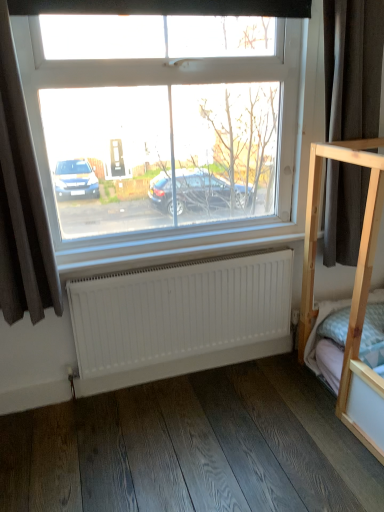
Measure the distance between white matte radiator at lower center and camera.

They are 1.84 meters apart.

The image size is (384, 512). What do you see at coordinates (352, 67) in the screenshot? I see `dark gray fabric at right, placed as the 1th curtain when sorted from right to left` at bounding box center [352, 67].

Where is `white matte radiator at lower center`? white matte radiator at lower center is located at coordinates (179, 311).

From a real-world perspective, is dark gray fabric at right, which is the 2th curtain in left-to-right order, on dark wood flooring at lower center?

Correct, in the physical world, dark gray fabric at right, which is the 2th curtain in left-to-right order, is higher than dark wood flooring at lower center.

Looking at this image, how different are the orientations of dark gray fabric at right, placed as the 1th curtain when sorted from right to left, and dark wood flooring at lower center in degrees?

There is a 90.2-degree angle between the facing directions of dark gray fabric at right, placed as the 1th curtain when sorted from right to left, and dark wood flooring at lower center.

Between point (347, 166) and point (64, 408), which one is positioned behind?

Positioned behind is point (64, 408).

Is dark gray fabric at right, placed as the 1th curtain when sorted from right to left, far away from dark wood flooring at lower center?

Indeed, dark gray fabric at right, placed as the 1th curtain when sorted from right to left, is not near dark wood flooring at lower center.

Would you consider dark wood flooring at lower center to be distant from white matte radiator at lower center?

No, dark wood flooring at lower center is not far away from white matte radiator at lower center.

From a real-world perspective, does dark wood flooring at lower center stand above white matte radiator at lower center?

No, from a real-world perspective, dark wood flooring at lower center is not over white matte radiator at lower center

Considering the positions of objects dark wood flooring at lower center and white matte radiator at lower center in the image provided, who is behind, dark wood flooring at lower center or white matte radiator at lower center?

white matte radiator at lower center is behind.

From the image's perspective, which one is positioned higher, dark wood flooring at lower center or white matte radiator at lower center?

white matte radiator at lower center is shown above in the image.

Are white matte radiator at lower center and brown fabric curtain at left, which is the 1th curtain in left-to-right order, far apart?

No.

Is white matte radiator at lower center positioned with its back to brown fabric curtain at left, the 2th curtain viewed from the right?

That's not correct — white matte radiator at lower center is not looking away from brown fabric curtain at left, the 2th curtain viewed from the right.

In terms of width, does white matte radiator at lower center look wider or thinner when compared to brown fabric curtain at left, the 2th curtain viewed from the right?

white matte radiator at lower center is thinner than brown fabric curtain at left, the 2th curtain viewed from the right.

Does point (191, 345) appear closer or farther from the camera than point (20, 232)?

Point (191, 345) is farther from the camera than point (20, 232).

Could you tell me if white matte radiator at lower center is facing dark wood flooring at lower center?

Yes, white matte radiator at lower center is oriented towards dark wood flooring at lower center.

Is white matte radiator at lower center bigger than dark wood flooring at lower center?

Indeed, white matte radiator at lower center has a larger size compared to dark wood flooring at lower center.

At what (x,y) coordinates should I click in order to perform the action: click on hardwood on the right of white matte radiator at lower center. Please return your answer as a coordinate pair (x, y). The height and width of the screenshot is (512, 384). Looking at the image, I should click on (192, 448).

Considering the sizes of objects brown fabric curtain at left, the 2th curtain viewed from the right, and dark gray fabric at right, placed as the 1th curtain when sorted from right to left, in the image provided, who is bigger, brown fabric curtain at left, the 2th curtain viewed from the right, or dark gray fabric at right, placed as the 1th curtain when sorted from right to left,?

dark gray fabric at right, placed as the 1th curtain when sorted from right to left.

Is brown fabric curtain at left, which is the 1th curtain in left-to-right order, at the left side of dark gray fabric at right, placed as the 1th curtain when sorted from right to left?

Indeed, brown fabric curtain at left, which is the 1th curtain in left-to-right order, is positioned on the left side of dark gray fabric at right, placed as the 1th curtain when sorted from right to left.

Looking at this image, from a real-world perspective, who is located lower, brown fabric curtain at left, the 2th curtain viewed from the right, or dark gray fabric at right, which is the 2th curtain in left-to-right order?

From a 3D spatial view, brown fabric curtain at left, the 2th curtain viewed from the right, is below.

How many degrees apart are the facing directions of brown fabric curtain at left, the 2th curtain viewed from the right, and dark gray fabric at right, which is the 2th curtain in left-to-right order?

brown fabric curtain at left, the 2th curtain viewed from the right, and dark gray fabric at right, which is the 2th curtain in left-to-right order, are facing 0.000832 degrees away from each other.

Which of these two, white matte radiator at lower center or dark gray fabric at right, placed as the 1th curtain when sorted from right to left, is wider?

dark gray fabric at right, placed as the 1th curtain when sorted from right to left, is wider.

Which of these two, white matte radiator at lower center or dark gray fabric at right, which is the 2th curtain in left-to-right order, is bigger?

Bigger between the two is dark gray fabric at right, which is the 2th curtain in left-to-right order.

Is point (116, 332) less distant than point (342, 179)?

Yes, point (116, 332) is closer to viewer.

Considering the positions of objects white matte radiator at lower center and dark gray fabric at right, placed as the 1th curtain when sorted from right to left, in the image provided, who is more to the left, white matte radiator at lower center or dark gray fabric at right, placed as the 1th curtain when sorted from right to left,?

Positioned to the left is white matte radiator at lower center.

In terms of size, does dark wood flooring at lower center appear bigger or smaller than dark gray fabric at right, placed as the 1th curtain when sorted from right to left?

Considering their sizes, dark wood flooring at lower center takes up less space than dark gray fabric at right, placed as the 1th curtain when sorted from right to left.

Does dark wood flooring at lower center turn towards dark gray fabric at right, placed as the 1th curtain when sorted from right to left?

No, dark wood flooring at lower center is not turned towards dark gray fabric at right, placed as the 1th curtain when sorted from right to left.

How distant is dark wood flooring at lower center from dark gray fabric at right, which is the 2th curtain in left-to-right order?

The distance of dark wood flooring at lower center from dark gray fabric at right, which is the 2th curtain in left-to-right order, is 1.21 meters.

What's the angular difference between dark wood flooring at lower center and dark gray fabric at right, which is the 2th curtain in left-to-right order,'s facing directions?

There is a 90.2-degree angle between the facing directions of dark wood flooring at lower center and dark gray fabric at right, which is the 2th curtain in left-to-right order.

This screenshot has height=512, width=384. Identify the location of hardwood on the left of dark gray fabric at right, placed as the 1th curtain when sorted from right to left. (192, 448).

Image resolution: width=384 pixels, height=512 pixels. Identify the location of radiator located above the dark wood flooring at lower center (from the image's perspective). (179, 311).

Considering their positions, is dark wood flooring at lower center positioned closer to dark gray fabric at right, placed as the 1th curtain when sorted from right to left, than white matte radiator at lower center?

white matte radiator at lower center lies closer to dark gray fabric at right, placed as the 1th curtain when sorted from right to left, than the other object.

Considering their positions, is dark wood flooring at lower center positioned further to white matte radiator at lower center than brown fabric curtain at left, the 2th curtain viewed from the right?

Based on the image, brown fabric curtain at left, the 2th curtain viewed from the right, appears to be further to white matte radiator at lower center.

Estimate the real-world distances between objects in this image. Which object is closer to dark gray fabric at right, placed as the 1th curtain when sorted from right to left, white matte radiator at lower center or dark wood flooring at lower center?

Among the two, white matte radiator at lower center is located nearer to dark gray fabric at right, placed as the 1th curtain when sorted from right to left.

From the image, which object appears to be nearer to dark gray fabric at right, placed as the 1th curtain when sorted from right to left, brown fabric curtain at left, the 2th curtain viewed from the right, or dark wood flooring at lower center?

dark wood flooring at lower center lies closer to dark gray fabric at right, placed as the 1th curtain when sorted from right to left, than the other object.

Based on their spatial positions, is dark gray fabric at right, which is the 2th curtain in left-to-right order, or white matte radiator at lower center further from dark wood flooring at lower center?

Based on the image, dark gray fabric at right, which is the 2th curtain in left-to-right order, appears to be further to dark wood flooring at lower center.

Looking at the image, which one is located closer to dark wood flooring at lower center, dark gray fabric at right, which is the 2th curtain in left-to-right order, or brown fabric curtain at left, the 2th curtain viewed from the right?

brown fabric curtain at left, the 2th curtain viewed from the right.

When comparing their distances from white matte radiator at lower center, does dark gray fabric at right, placed as the 1th curtain when sorted from right to left, or dark wood flooring at lower center seem closer?

The object closer to white matte radiator at lower center is dark wood flooring at lower center.

From the image, which object appears to be farther from dark gray fabric at right, which is the 2th curtain in left-to-right order, brown fabric curtain at left, the 2th curtain viewed from the right, or white matte radiator at lower center?

Based on the image, brown fabric curtain at left, the 2th curtain viewed from the right, appears to be further to dark gray fabric at right, which is the 2th curtain in left-to-right order.

Locate an element on the screen. The width and height of the screenshot is (384, 512). hardwood between brown fabric curtain at left, which is the 1th curtain in left-to-right order, and dark gray fabric at right, placed as the 1th curtain when sorted from right to left, in the horizontal direction is located at coordinates (192, 448).

At what (x,y) coordinates should I click in order to perform the action: click on radiator that lies between brown fabric curtain at left, the 2th curtain viewed from the right, and dark wood flooring at lower center from top to bottom. Please return your answer as a coordinate pair (x, y). The height and width of the screenshot is (512, 384). Looking at the image, I should click on click(x=179, y=311).

The height and width of the screenshot is (512, 384). I want to click on radiator between brown fabric curtain at left, the 2th curtain viewed from the right, and dark gray fabric at right, which is the 2th curtain in left-to-right order, so click(x=179, y=311).

At what (x,y) coordinates should I click in order to perform the action: click on radiator that lies between dark gray fabric at right, which is the 2th curtain in left-to-right order, and dark wood flooring at lower center from top to bottom. Please return your answer as a coordinate pair (x, y). The width and height of the screenshot is (384, 512). Looking at the image, I should click on (179, 311).